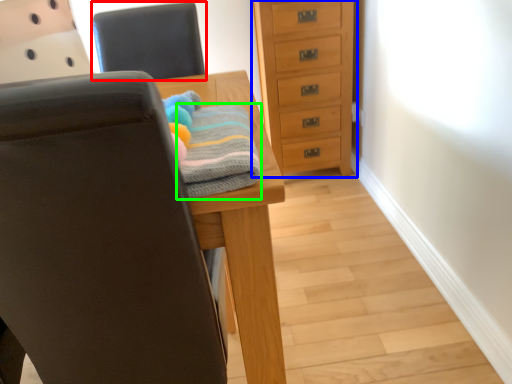
Question: Estimate the real-world distances between objects in this image. Which object is farther from chair (highlighted by a red box), chest of drawers (highlighted by a blue box) or bath towel (highlighted by a green box)?

Choices:
 (A) chest of drawers
 (B) bath towel

Answer: (B)